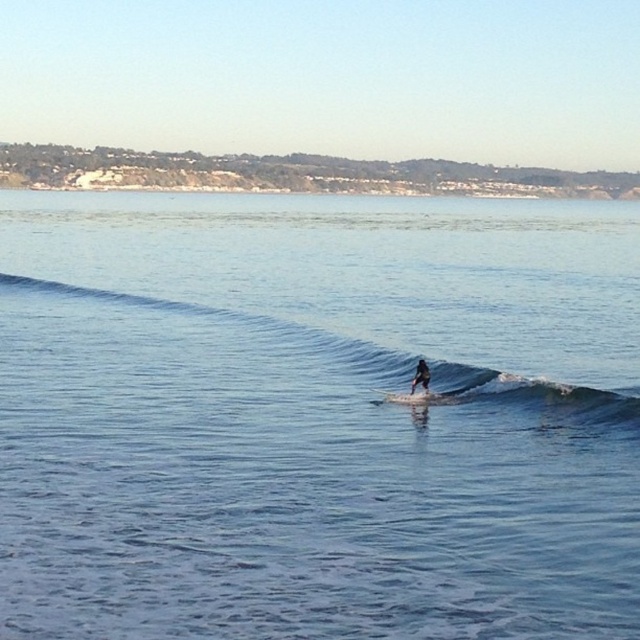
Which is in front, point (612, 388) or point (419, 364)?

Point (419, 364)

Does point (588, 369) come in front of point (420, 374)?

No, (588, 369) is behind (420, 374).

Between point (236, 358) and point (420, 385), which one is positioned behind?

The point (236, 358) is behind.

Identify the location of blue water at center. The width and height of the screenshot is (640, 640). (317, 417).

Does blue water at center have a greater width compared to black matte surfboard at center?

Indeed, blue water at center has a greater width compared to black matte surfboard at center.

The width and height of the screenshot is (640, 640). Describe the element at coordinates (317, 417) in the screenshot. I see `blue water at center` at that location.

The image size is (640, 640). What do you see at coordinates (317, 417) in the screenshot?
I see `blue water at center` at bounding box center [317, 417].

I want to click on blue water at center, so click(x=317, y=417).

The width and height of the screenshot is (640, 640). What do you see at coordinates (317, 417) in the screenshot?
I see `blue water at center` at bounding box center [317, 417].

Consider the image. Can you confirm if blue water at center is bigger than blue smooth wave at center?

Yes, blue water at center is bigger than blue smooth wave at center.

Is point (112, 349) positioned in front of point (580, 390)?

No, it is not.

This screenshot has height=640, width=640. I want to click on blue water at center, so click(317, 417).